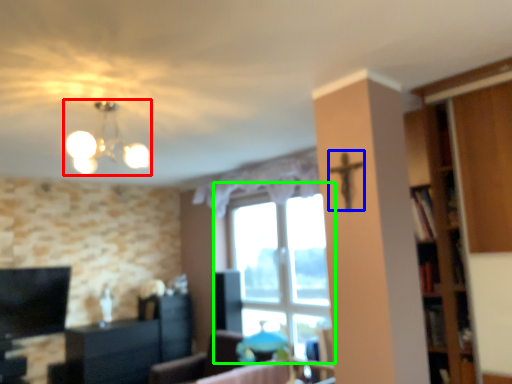
Question: Based on their relative distances, which object is nearer to lamp (highlighted by a red box)? Choose from crucifix (highlighted by a blue box) and window (highlighted by a green box).

Choices:
 (A) crucifix
 (B) window

Answer: (A)